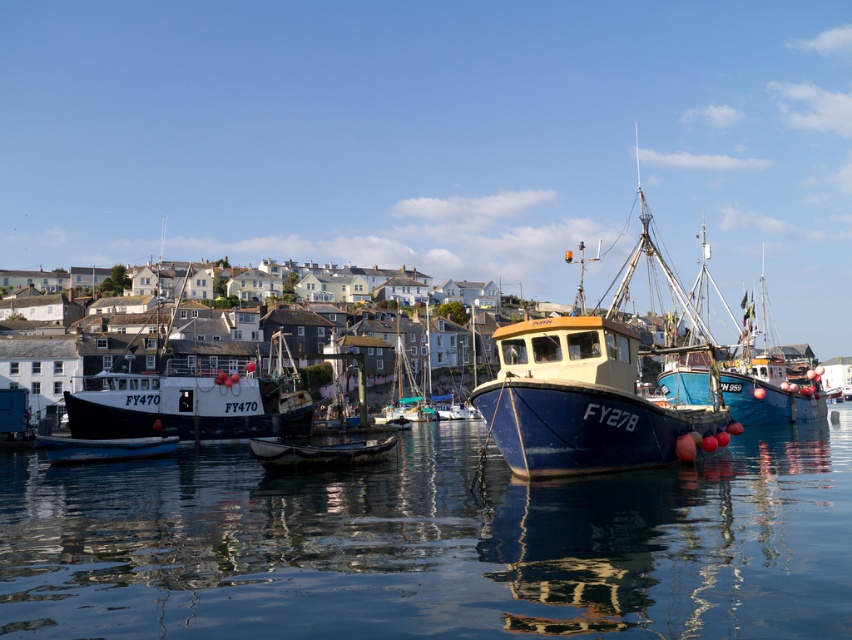
Question: Does black matte fishing boat at center appear under white matte dinghy at center?

Choices:
 (A) yes
 (B) no

Answer: (B)

Question: Which of these objects is positioned closest to the blue matte fishing boat at center?

Choices:
 (A) white matte dinghy at center
 (B) white matte dinghy at lower left
 (C) matte blue boat at center
 (D) glossy blue water at center

Answer: (C)

Question: Where is blue matte fishing boat at center located in relation to white matte dinghy at lower left in the image?

Choices:
 (A) left
 (B) right

Answer: (B)

Question: Which object is positioned farthest from the glossy blue water at center?

Choices:
 (A) black matte fishing boat at center
 (B) blue matte fishing boat at center

Answer: (A)

Question: Can you confirm if black matte fishing boat at center is wider than white matte dinghy at lower left?

Choices:
 (A) no
 (B) yes

Answer: (B)

Question: Which point appears farthest from the camera in this image?

Choices:
 (A) [643, 516]
 (B) [174, 449]
 (C) [209, 419]

Answer: (C)